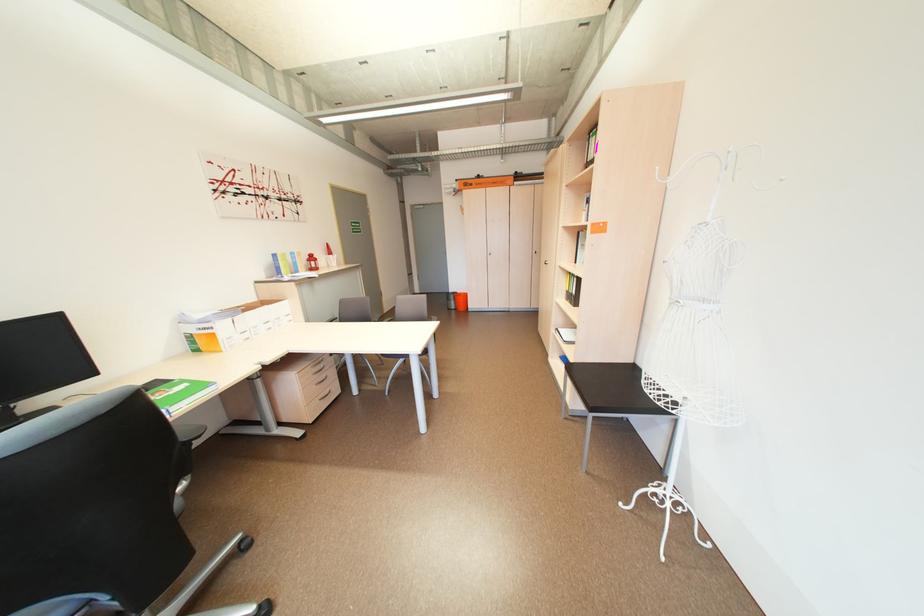
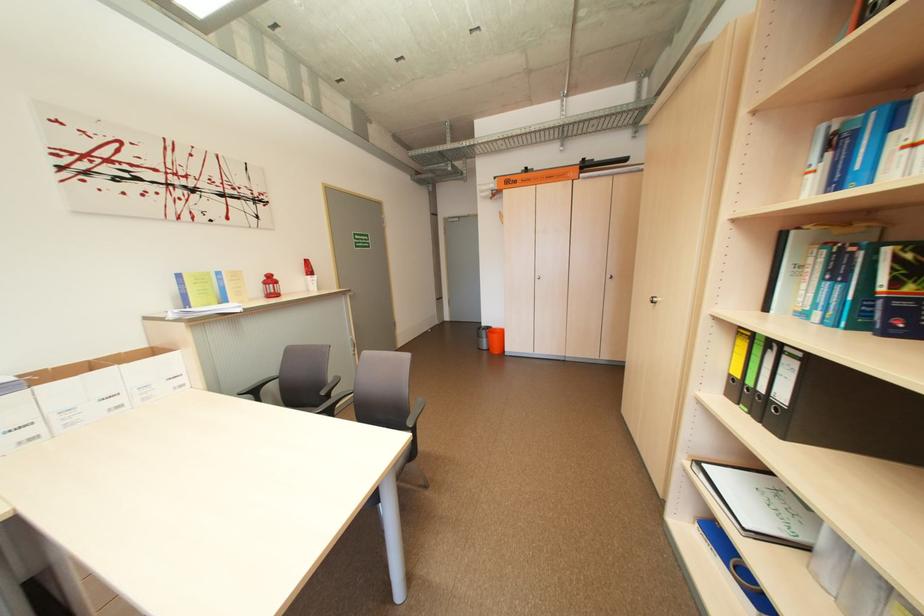
Where in the second image is the point corresponding to point (577, 293) from the first image?

(743, 379)